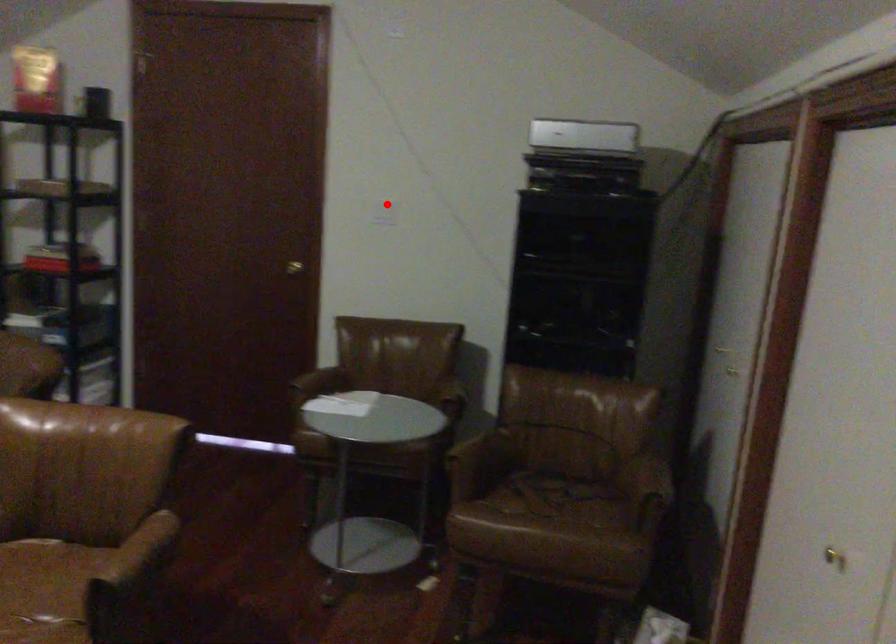
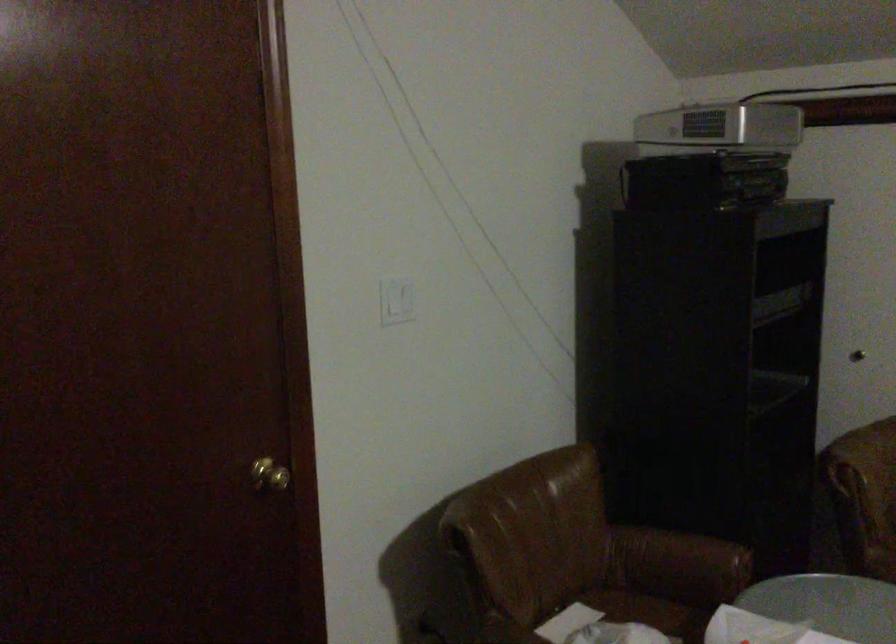
Locate, in the second image, the point that corresponds to the highlighted location in the first image.

(397, 301)